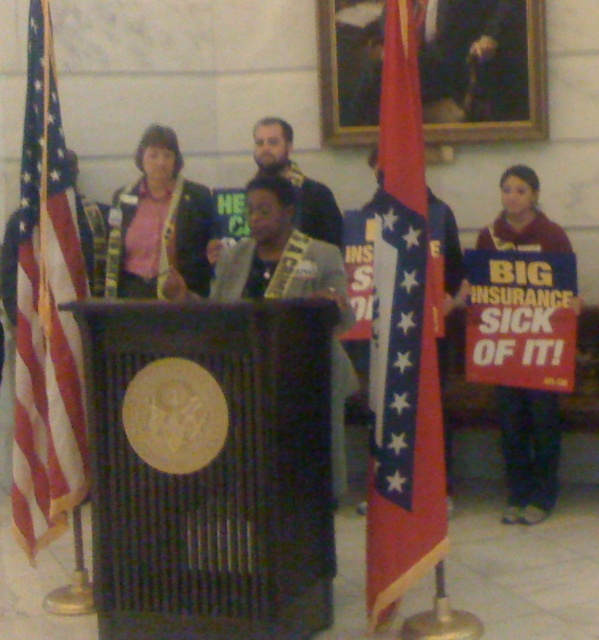
Based on the photo, you are an event organizer who needs to adjust the stage setup. The red fabric flag at center and the maroon fabric sign at right are currently blocking each other. Which object should you move to ensure both are visible to the audience?

The red fabric flag at center is positioned over the maroon fabric sign at right. To ensure both are visible, you should move the red fabric flag at center so it no longer covers the maroon fabric sign at right.

You are an attendee at this event and want to take a photo of the speaker without the flag blocking the view. Which object should you move closer to or farther from to ensure the matte pink shirt at center is visible and the red fabric flag at center is not in the frame?

To ensure the matte pink shirt at center is visible and the red fabric flag at center is not in the frame, you should move farther away from the red fabric flag at center. Since the red fabric flag at center is in front of the matte pink shirt at center, increasing the distance between you and the flag will reduce its apparent size, potentially allowing the shirt to become visible behind it.